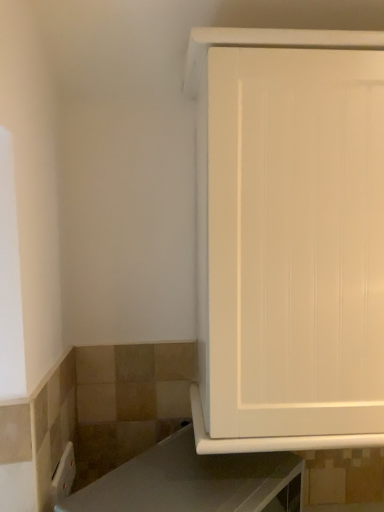
Question: Considering the relative positions of white matte cabinet at upper right and white glossy countertop at lower right in the image provided, is white matte cabinet at upper right behind white glossy countertop at lower right?

Choices:
 (A) no
 (B) yes

Answer: (B)

Question: Can you see white matte cabinet at upper right touching white glossy countertop at lower right?

Choices:
 (A) yes
 (B) no

Answer: (B)

Question: Does white matte cabinet at upper right have a greater height compared to white glossy countertop at lower right?

Choices:
 (A) yes
 (B) no

Answer: (A)

Question: From the image's perspective, is white matte cabinet at upper right on white glossy countertop at lower right?

Choices:
 (A) yes
 (B) no

Answer: (A)

Question: Is white matte cabinet at upper right oriented towards white glossy countertop at lower right?

Choices:
 (A) no
 (B) yes

Answer: (A)

Question: Is white matte cabinet at upper right thinner than white glossy countertop at lower right?

Choices:
 (A) yes
 (B) no

Answer: (B)

Question: Is white matte cabinet at upper right located within white glossy countertop at lower right?

Choices:
 (A) no
 (B) yes

Answer: (A)

Question: From a real-world perspective, is white glossy countertop at lower right physically below white matte cabinet at upper right?

Choices:
 (A) yes
 (B) no

Answer: (A)

Question: From a real-world perspective, is white glossy countertop at lower right on top of white matte cabinet at upper right?

Choices:
 (A) yes
 (B) no

Answer: (B)

Question: Considering the relative sizes of white glossy countertop at lower right and white matte cabinet at upper right in the image provided, is white glossy countertop at lower right smaller than white matte cabinet at upper right?

Choices:
 (A) no
 (B) yes

Answer: (B)

Question: Is there a large distance between white glossy countertop at lower right and white matte cabinet at upper right?

Choices:
 (A) yes
 (B) no

Answer: (B)

Question: Considering the relative sizes of white glossy countertop at lower right and white matte cabinet at upper right in the image provided, is white glossy countertop at lower right thinner than white matte cabinet at upper right?

Choices:
 (A) no
 (B) yes

Answer: (B)

Question: Relative to white matte cabinet at upper right, is white glossy countertop at lower right in front or behind?

Choices:
 (A) front
 (B) behind

Answer: (A)